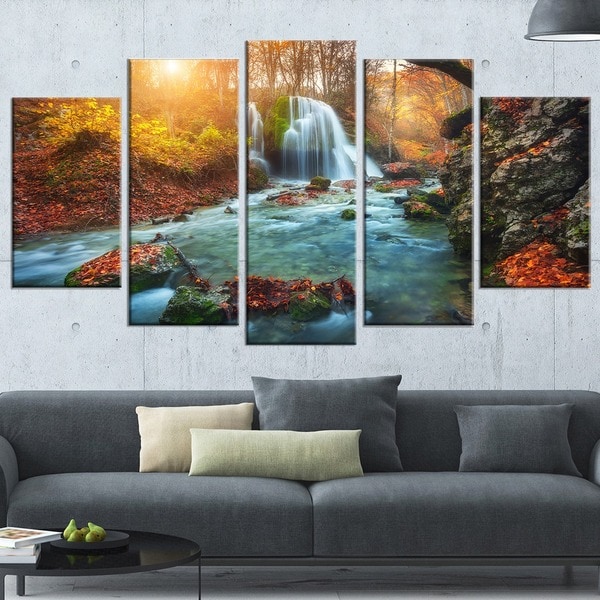
This screenshot has height=600, width=600. I want to click on couch, so click(x=353, y=527).